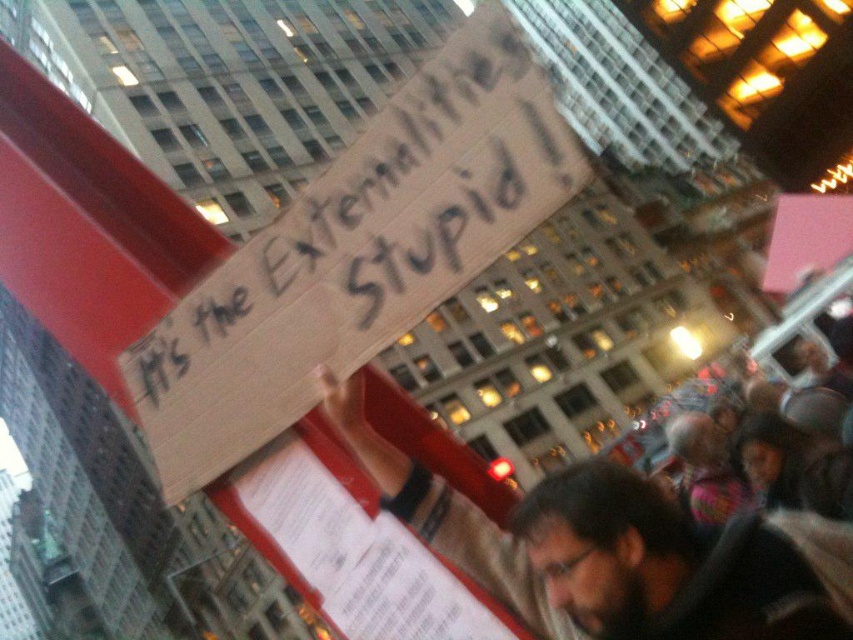
Does handwritten cardboard sign at center have a greater width compared to dark brown hair at center?

Indeed, handwritten cardboard sign at center has a greater width compared to dark brown hair at center.

Which is in front, point (532, 156) or point (633, 483)?

Point (532, 156)

In order to click on handwritten cardboard sign at center in this screenshot , I will do `click(373, 234)`.

This screenshot has width=853, height=640. In order to click on handwritten cardboard sign at center in this screenshot , I will do `click(373, 234)`.

Is point (751, 566) behind point (721, 481)?

No, (751, 566) is closer to viewer.

Who is more distant from viewer, (746, 547) or (682, 428)?

Point (682, 428)

Which is in front, point (839, 541) or point (675, 449)?

Point (839, 541) is in front.

You are a GUI agent. You are given a task and a screenshot of the screen. Output one action in this format:
    pyautogui.click(x=<x>, y=<y>)
    Task: Click on the dark brown hair at center
    Image resolution: width=853 pixels, height=640 pixels.
    Given the screenshot: What is the action you would take?
    pyautogui.click(x=682, y=563)

Who is more forward, (410, 269) or (689, 465)?

Point (410, 269) is more forward.

Locate an element on the screen. handwritten cardboard sign at center is located at coordinates (373, 234).

Is point (482, 54) positioned before point (709, 492)?

That is True.

Where is `handwritten cardboard sign at center`? The image size is (853, 640). handwritten cardboard sign at center is located at coordinates (373, 234).